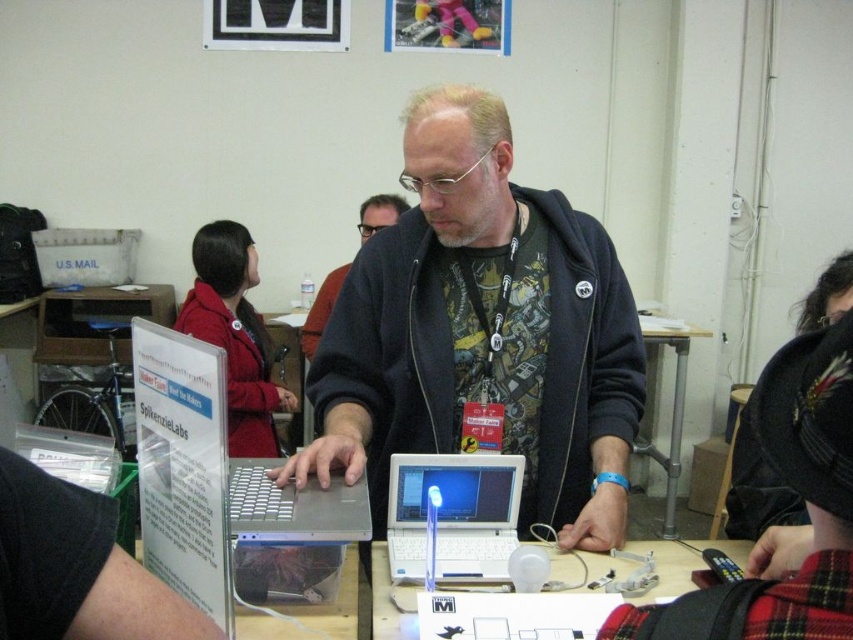
Question: Which object appears closest to the camera in this image?

Choices:
 (A) white plastic laptop at center
 (B) metallic silver table at center

Answer: (A)

Question: Which of these objects is positioned farthest from the brushed metal sign at upper left?

Choices:
 (A) white plastic laptop at center
 (B) matte black laptop at center
 (C) white plastic table at center

Answer: (B)

Question: Is brushed metal sign at upper left to the right of red wool coat at upper left from the viewer's perspective?

Choices:
 (A) no
 (B) yes

Answer: (B)

Question: Does matte black laptop at center come in front of white plastic laptop at center?

Choices:
 (A) yes
 (B) no

Answer: (A)

Question: From the image, what is the correct spatial relationship of matte black laptop at center in relation to brushed metal sign at upper left?

Choices:
 (A) right
 (B) left

Answer: (A)

Question: Estimate the real-world distances between objects in this image. Which object is farther from the brushed metal sign at upper left?

Choices:
 (A) metallic silver table at center
 (B) red wool coat at upper left
 (C) white plastic table at center
 (D) matte black laptop at center

Answer: (A)